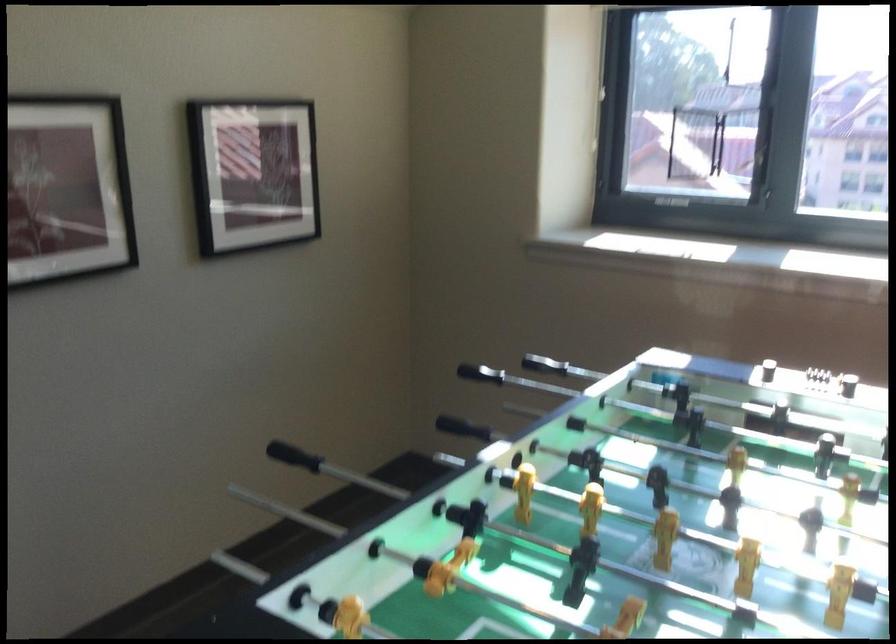
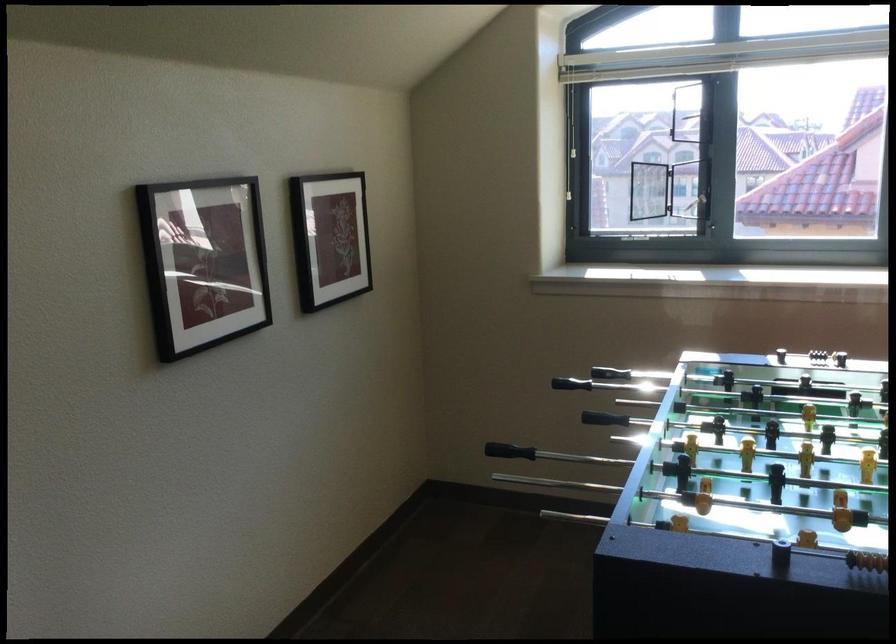
Find the pixel in the second image that matches point (552, 382) in the first image.

(570, 384)